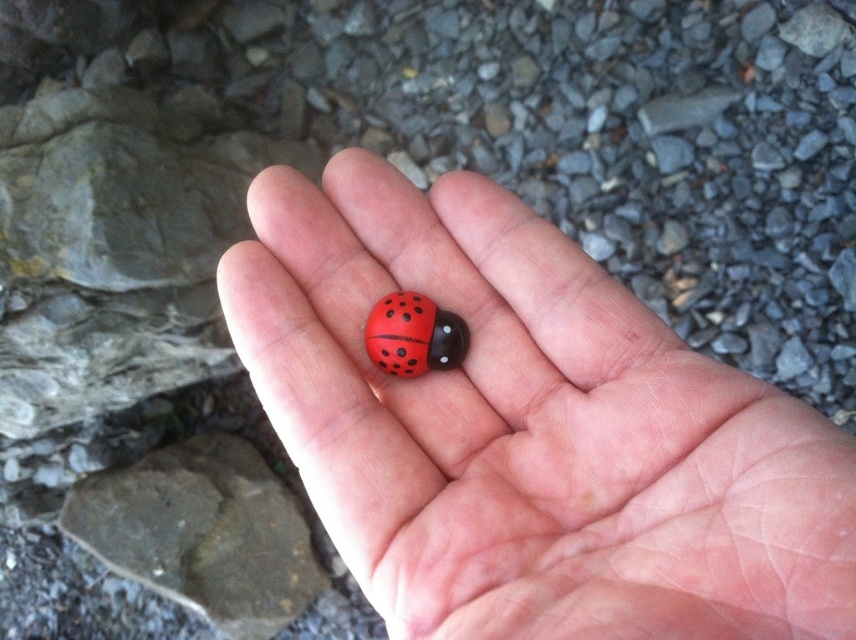
You are an artist creating a miniature sculpture. You have the matte plastic ladybug at center and the smooth gray rock at lower left in your workspace. If you want to place both items on a display stand that can only accommodate the smaller of the two, which object should you choose?

The matte plastic ladybug at center has a lesser width compared to the smooth gray rock at lower left, so you should choose the matte plastic ladybug at center for the display stand.

You are an artist creating a model of insects. You have two objects in front of you, a matte plastic ladybug at center and a matte plastic ladybird at center. Which one is larger?

The matte plastic ladybug at center is bigger than the matte plastic ladybird at center according to the description.

You are a photographer aiming to capture a detailed closeup of the smooth gray rock at lower left. Given that your camera has a minimum focusing distance of 1.2 meters, can you take the photo without moving closer than your current position?

The smooth gray rock at lower left is 1.38 meters away from the camera. Since the minimum focusing distance is 1.2 meters, you need to move closer to within 1.2 meters to capture the closeup.